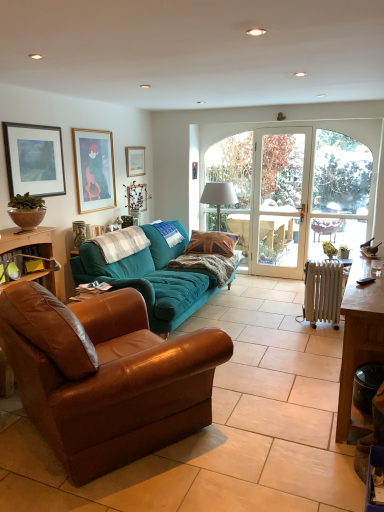
You are a GUI agent. You are given a task and a screenshot of the screen. Output one action in this format:
    pyautogui.click(x=<x>, y=<y>)
    Task: Click on the free space in front of metallic radiator at lower right
    This screenshot has height=512, width=384.
    Given the screenshot: What is the action you would take?
    pyautogui.click(x=330, y=333)